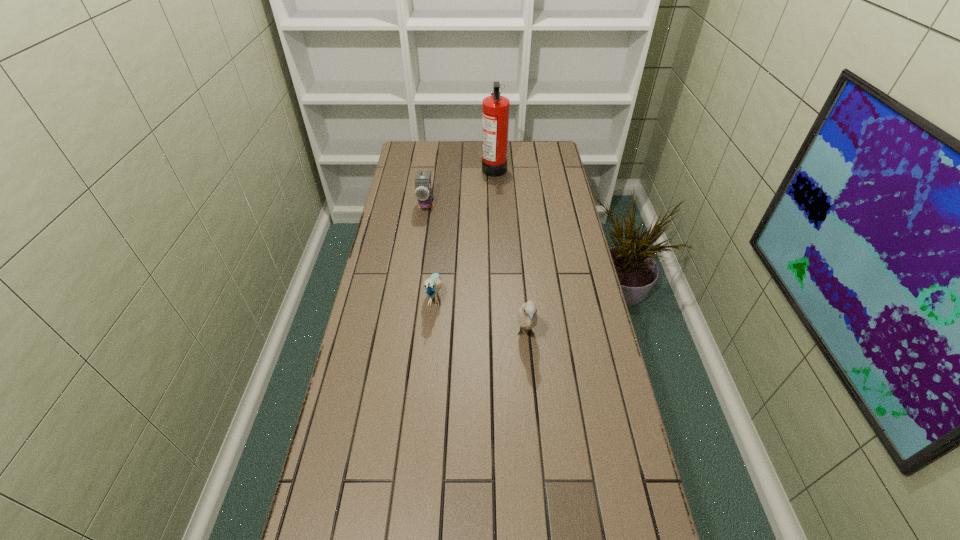
You are a GUI agent. You are given a task and a screenshot of the screen. Output one action in this format:
    pyautogui.click(x=<x>, y=<y>)
    Task: Click on the farthest object
    
    Given the screenshot: What is the action you would take?
    pyautogui.click(x=495, y=109)

Locate an element on the screen. The width and height of the screenshot is (960, 540). the tallest object is located at coordinates (495, 109).

Where is `the rightmost bird`? This screenshot has width=960, height=540. the rightmost bird is located at coordinates (527, 315).

Where is `the leftmost bird`? The height and width of the screenshot is (540, 960). the leftmost bird is located at coordinates (423, 194).

The width and height of the screenshot is (960, 540). I want to click on the leftmost object, so click(423, 194).

The height and width of the screenshot is (540, 960). I want to click on the third object from right to left, so click(x=432, y=285).

Locate an element on the screen. This screenshot has height=540, width=960. free location located 0.270m on the front-facing side of the fire extinguisher is located at coordinates (423, 167).

Locate an element on the screen. The image size is (960, 540). vacant space positioned on the front-facing side of the fire extinguisher is located at coordinates (423, 167).

The image size is (960, 540). In order to click on free region located on the front-facing side of the fire extinguisher in this screenshot , I will do `click(399, 167)`.

Find the location of a particular element. This screenshot has height=540, width=960. vacant region located at the beak of the rightmost bird is located at coordinates (531, 391).